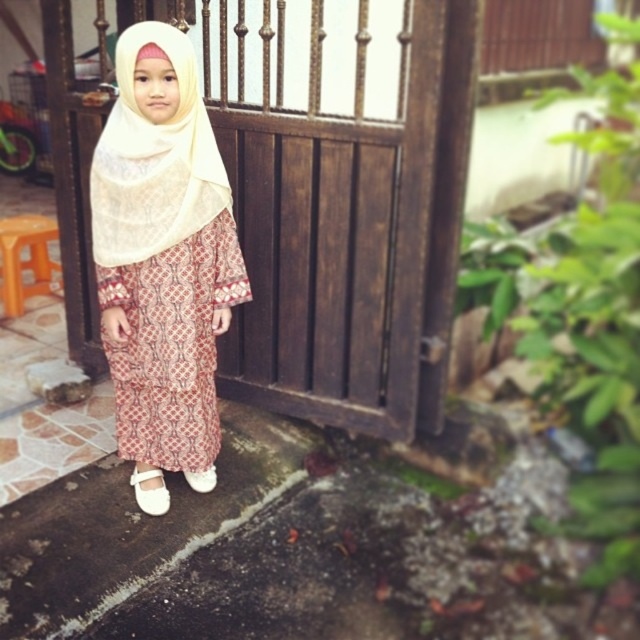
You are a photographer standing in front of the wooden gate. You want to take a closeup shot of the matte beige hijab at center. Given that your camera can focus on objects within 2 meters, will you need to move closer or farther away?

The matte beige hijab at center is 2.48 meters away from the viewer. Since the camera can focus within 2 meters, you need to move closer to be within 2 meters to capture the closeup.

You are a photographer trying to capture the girl in the scene. You notice the matte beige hijab at center and the white fabric shoe at lower center. From the photographer perspective, which object is positioned to the left?

The matte beige hijab at center is positioned to the left of the white fabric shoe at lower center.